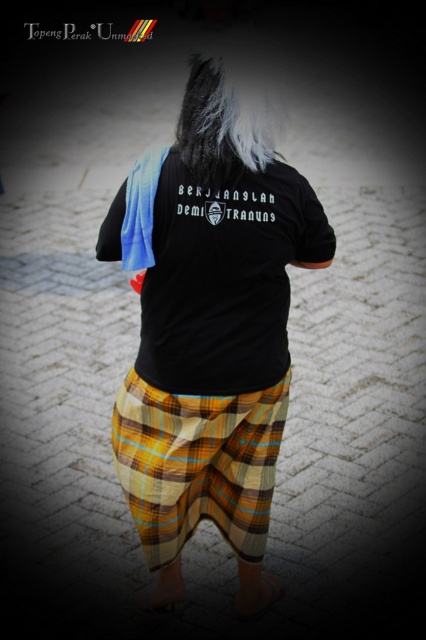
In the scene shown: Which of these two, yellow plaid sarong at center or white silky hair at upper center, stands shorter?

white silky hair at upper center

Which is above, yellow plaid sarong at center or white silky hair at upper center?

white silky hair at upper center is higher up.

Between point (218, 408) and point (247, 152), which one is positioned in front?

Point (247, 152) is in front.

Where is `yellow plaid sarong at center`? This screenshot has width=426, height=640. yellow plaid sarong at center is located at coordinates (198, 465).

Is black cotton t-shirt at center behind white silky hair at upper center?

Yes, black cotton t-shirt at center is behind white silky hair at upper center.

Is black cotton t-shirt at center positioned before white silky hair at upper center?

No, it is not.

Is point (222, 300) farther from camera compared to point (215, 145)?

Yes, it is behind point (215, 145).

This screenshot has height=640, width=426. I want to click on black cotton t-shirt at center, so click(224, 276).

Can you confirm if black cotton t-shirt at center is bigger than yellow plaid sarong at center?

Actually, black cotton t-shirt at center might be smaller than yellow plaid sarong at center.

Does black cotton t-shirt at center have a greater height compared to yellow plaid sarong at center?

Yes, black cotton t-shirt at center is taller than yellow plaid sarong at center.

Which is behind, point (158, 332) or point (161, 412)?

The point (161, 412) is more distant.

Find the location of a particular element. The width and height of the screenshot is (426, 640). black cotton t-shirt at center is located at coordinates (224, 276).